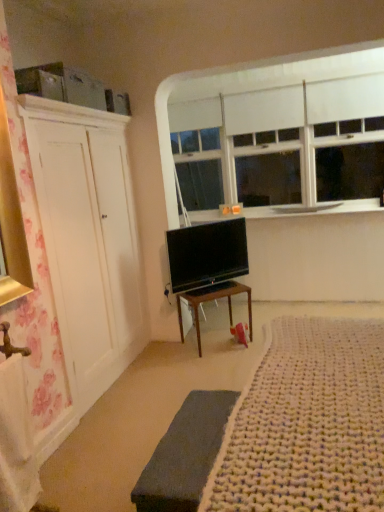
The height and width of the screenshot is (512, 384). I want to click on free location above white smooth window sill at upper center (from a real-world perspective), so click(x=281, y=211).